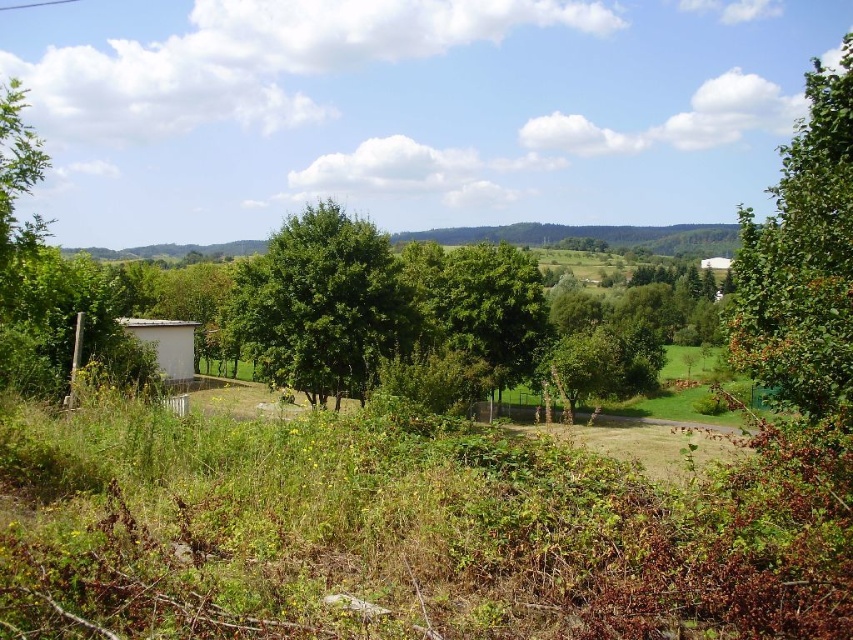
Question: Among these points, which one is nearest to the camera?

Choices:
 (A) (843, 61)
 (B) (360, 273)

Answer: (A)

Question: Which point appears farthest from the camera in this image?

Choices:
 (A) (848, 84)
 (B) (167, 371)
 (C) (236, 316)
 (D) (720, 257)

Answer: (D)

Question: Is green leafy tree at center further to the viewer compared to white wood hut at lower left?

Choices:
 (A) yes
 (B) no

Answer: (A)

Question: Which of the following is the farthest from the observer?

Choices:
 (A) [811, 99]
 (B) [132, 324]
 (C) [287, 275]

Answer: (B)

Question: Does green leafy tree at right appear on the right side of white wood hut at lower left?

Choices:
 (A) yes
 (B) no

Answer: (A)

Question: Is white wood hut at lower left bigger than white matte hut at center?

Choices:
 (A) yes
 (B) no

Answer: (A)